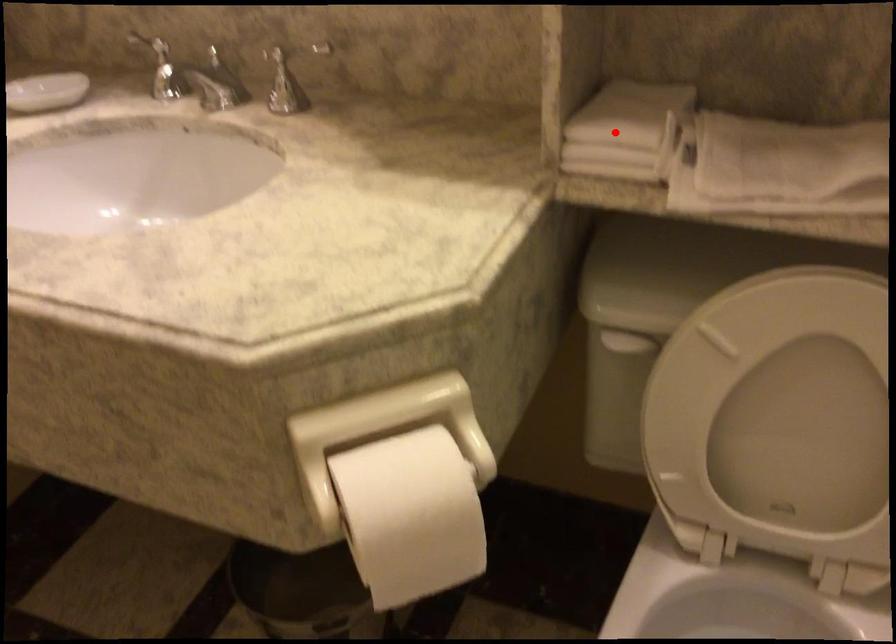
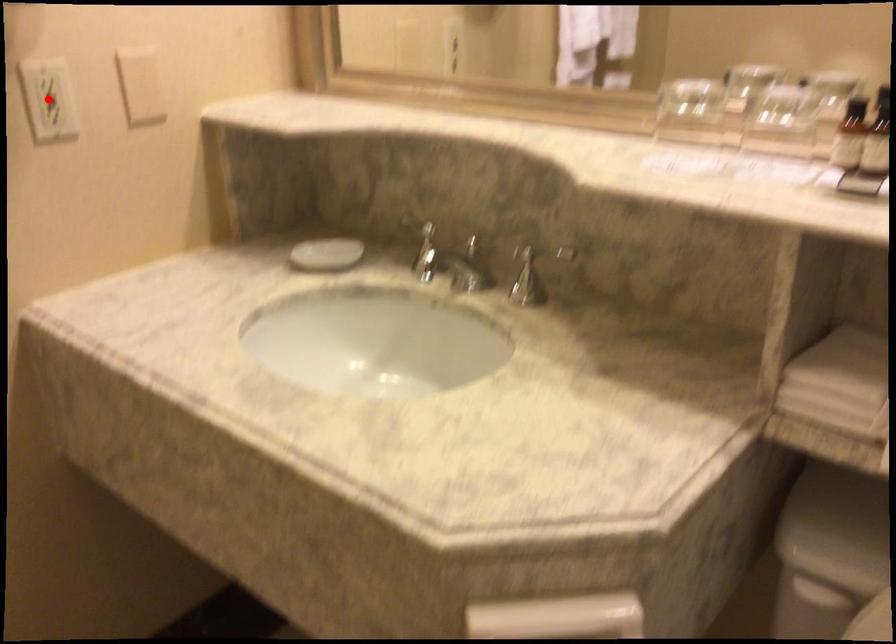
I am providing you with two images of the same scene from different viewpoints. A red point is marked on the first image and another point is marked on the second image. Do the highlighted points in image1 and image2 indicate the same real-world spot?

No